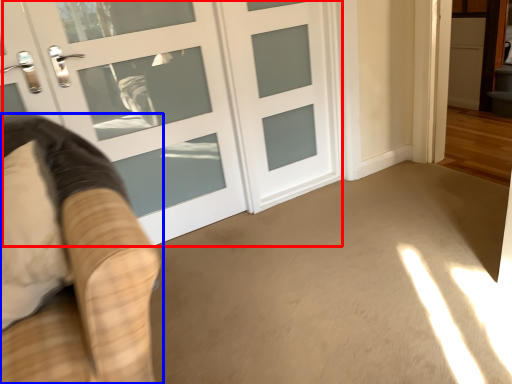
Question: Which object is closer to the camera taking this photo, door (highlighted by a red box) or furniture (highlighted by a blue box)?

Choices:
 (A) door
 (B) furniture

Answer: (B)